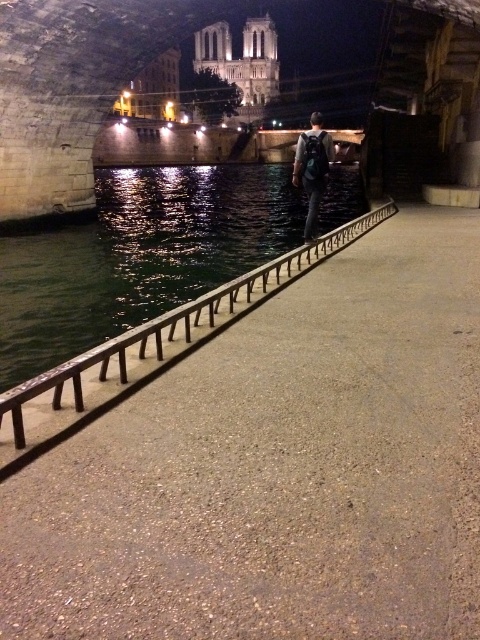
Is black metal rail at center above dark blue backpack at center?

Incorrect, black metal rail at center is not positioned above dark blue backpack at center.

Can you confirm if black metal rail at center is positioned to the left of dark blue backpack at center?

Yes, black metal rail at center is to the left of dark blue backpack at center.

The width and height of the screenshot is (480, 640). In order to click on black metal rail at center in this screenshot , I will do `click(147, 349)`.